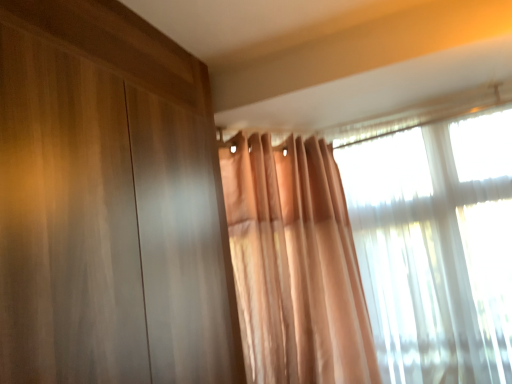
You are a GUI agent. You are given a task and a screenshot of the screen. Output one action in this format:
    pyautogui.click(x=<x>, y=<y>)
    Task: Click on the translucent fabric at upper right
    The width and height of the screenshot is (512, 384).
    Given the screenshot: What is the action you would take?
    pyautogui.click(x=436, y=248)

This screenshot has height=384, width=512. Describe the element at coordinates (436, 248) in the screenshot. I see `translucent fabric at upper right` at that location.

Where is `translucent fabric at upper right`? This screenshot has height=384, width=512. translucent fabric at upper right is located at coordinates (436, 248).